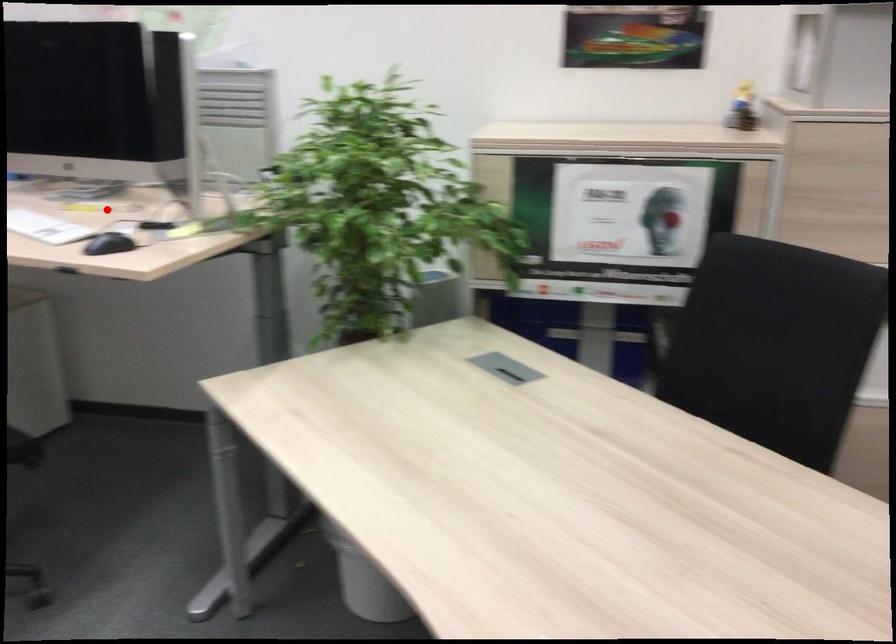
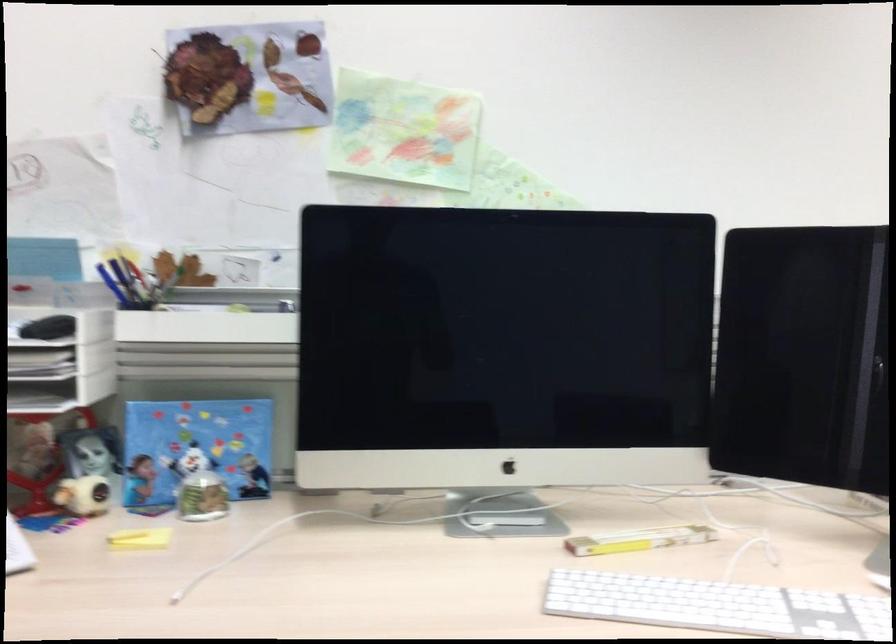
Question: I am providing you with two images of the same scene from different viewpoints. A red point is shown in image1. For the corresponding object point in image2, is it positioned nearer or farther from the camera?

Choices:
 (A) Nearer
 (B) Farther

Answer: (A)